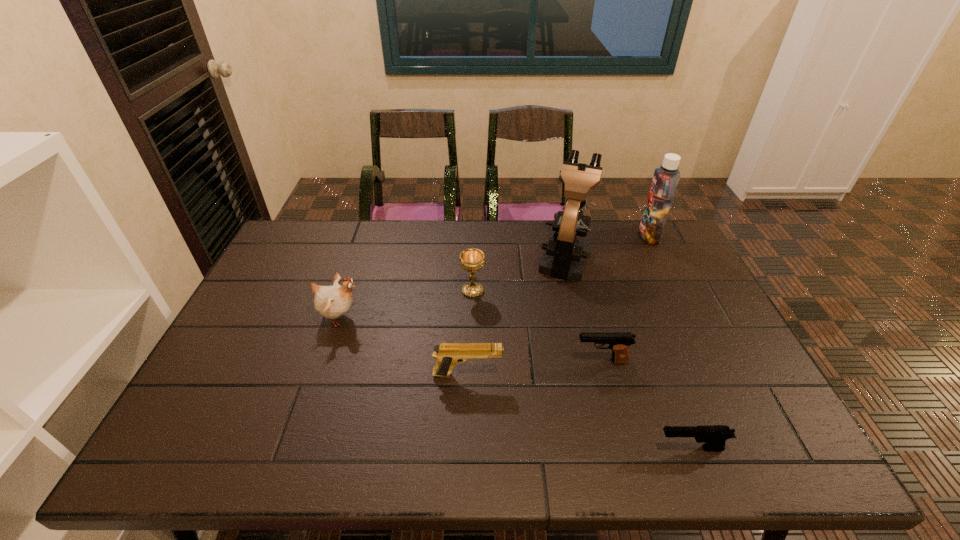
Identify the location of vacant space in between the shampoo and the microscope. (607, 247).

I want to click on free space between the nearest object and the second nearest object, so click(x=579, y=411).

The width and height of the screenshot is (960, 540). Find the location of `empty location between the chalice and the shortest object`. empty location between the chalice and the shortest object is located at coordinates (582, 370).

Find the location of a particular element. Image resolution: width=960 pixels, height=540 pixels. free space that is in between the chalice and the second nearest object is located at coordinates (470, 333).

What are the coordinates of `vacant space that's between the microscope and the bird` in the screenshot? It's located at (452, 287).

This screenshot has height=540, width=960. In order to click on vacant space that is in between the second object from right to left and the shampoo in this screenshot , I will do `click(670, 342)`.

Identify the location of vacant space in between the nearest pistol and the second nearest pistol. (579, 411).

Choose which object is the fourth nearest neighbor to the microscope. Please provide its 2D coordinates. Your answer should be formatted as a tuple, i.e. [(x, y)], where the tuple contains the x and y coordinates of a point satisfying the conditions above.

[(447, 354)]

The width and height of the screenshot is (960, 540). What are the coordinates of `object that is the second nearest to the shortest object` in the screenshot? It's located at (447, 354).

Locate an element on the screen. pistol that is the closest one to the microscope is located at coordinates (619, 342).